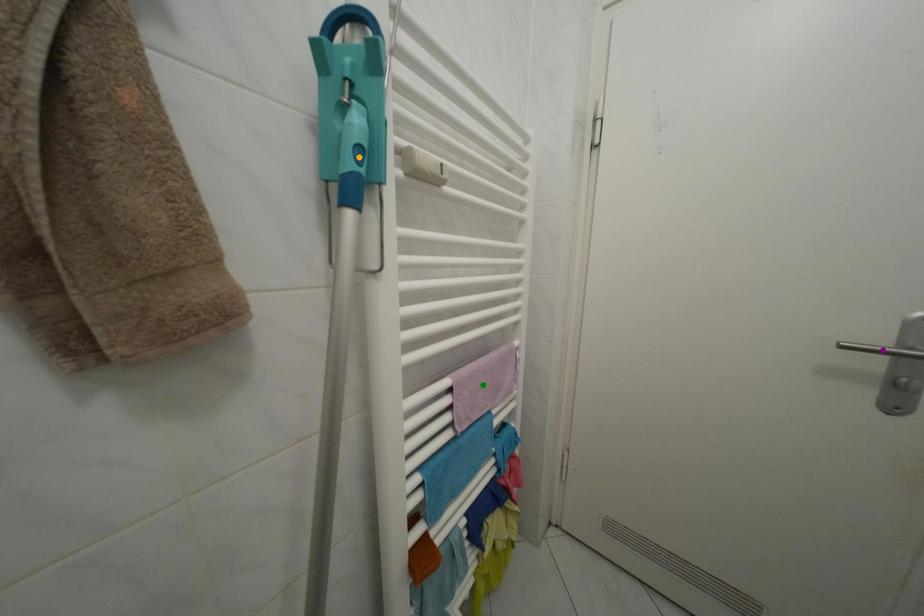
Order these from nearest to farthest:
- orange point
- purple point
- green point

orange point < purple point < green point